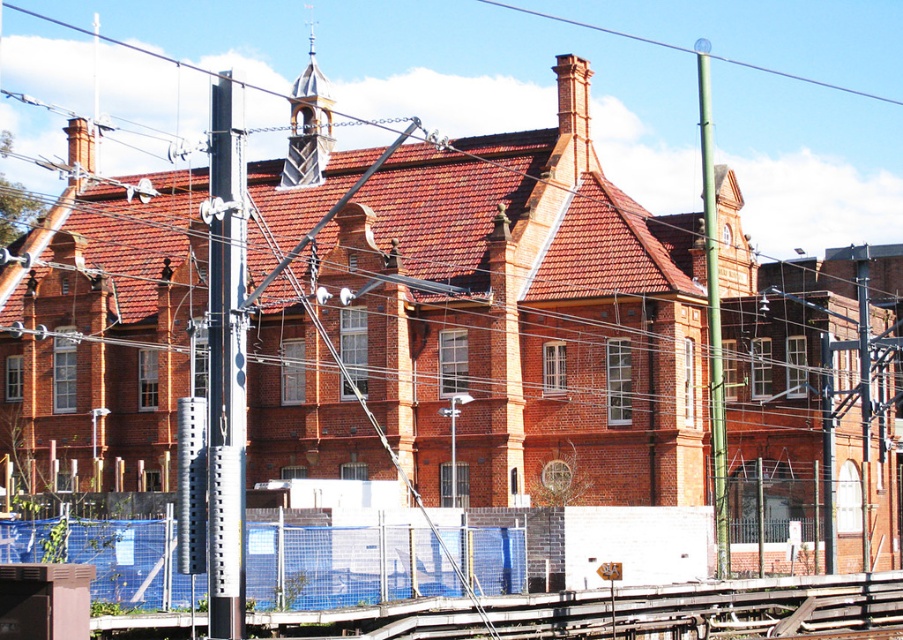
Question: Which point is farther from the camera taking this photo?

Choices:
 (A) (213, 200)
 (B) (713, 412)
 (C) (654, 44)

Answer: (C)

Question: Does metallic gray pole at left have a greater width compared to metallic wire at upper center?

Choices:
 (A) yes
 (B) no

Answer: (B)

Question: Can you confirm if metallic gray pole at left is smaller than green metallic pole at right?

Choices:
 (A) no
 (B) yes

Answer: (B)

Question: Which point is farther to the camera?

Choices:
 (A) (213, 205)
 (B) (718, 342)
 (C) (863, 96)

Answer: (C)

Question: Does green metallic pole at right have a smaller size compared to metallic wire at upper center?

Choices:
 (A) yes
 (B) no

Answer: (B)

Question: Which point is farther to the camera?

Choices:
 (A) (715, 333)
 (B) (798, 76)

Answer: (B)